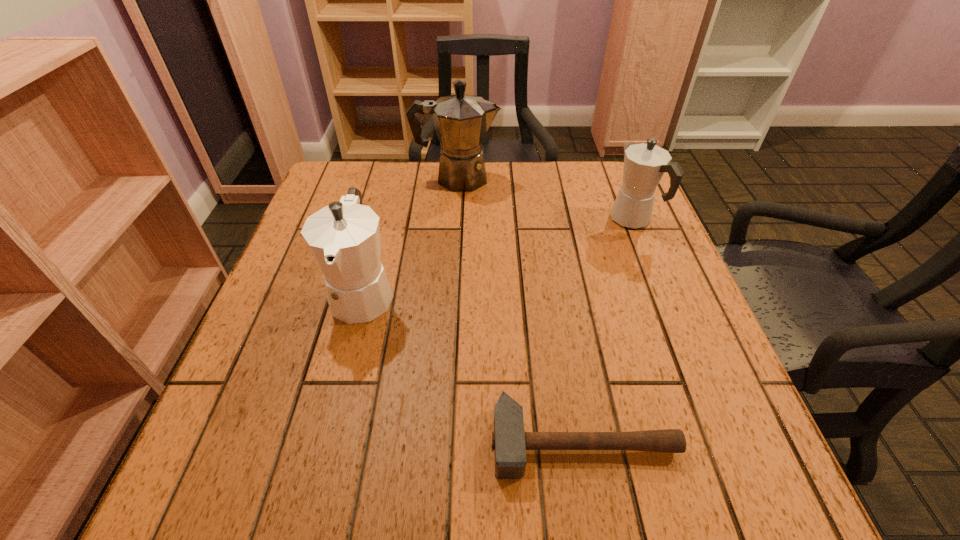
Locate an element on the screen. free point between the third farthest object and the farthest coffeepot is located at coordinates (410, 235).

At what (x,y) coordinates should I click in order to perform the action: click on empty location between the farthest object and the rightmost coffeepot. Please return your answer as a coordinate pair (x, y). The image size is (960, 540). Looking at the image, I should click on (545, 199).

Identify the location of vacant point located between the farthest object and the rightmost object. This screenshot has width=960, height=540. (545, 199).

Where is `free point between the farthest object and the third nearest object`? The height and width of the screenshot is (540, 960). free point between the farthest object and the third nearest object is located at coordinates (545, 199).

Locate an element on the screen. The height and width of the screenshot is (540, 960). vacant region between the farthest coffeepot and the nearest object is located at coordinates (519, 309).

At what (x,y) coordinates should I click in order to perform the action: click on free spot between the third nearest object and the second nearest object. Please return your answer as a coordinate pair (x, y). Looking at the image, I should click on (498, 256).

You are a GUI agent. You are given a task and a screenshot of the screen. Output one action in this format:
    pyautogui.click(x=<x>, y=<y>)
    Task: Click on the blank region between the hammer and the rightmost coffeepot
    
    Given the screenshot: What is the action you would take?
    [x=608, y=330]

Where is `vacant space that is in between the third nearest object and the second nearest object`? vacant space that is in between the third nearest object and the second nearest object is located at coordinates (498, 256).

In order to click on free space between the third farthest object and the rightmost coffeepot in this screenshot , I will do `click(498, 256)`.

The width and height of the screenshot is (960, 540). I want to click on free space between the nearest coffeepot and the rightmost coffeepot, so click(x=498, y=256).